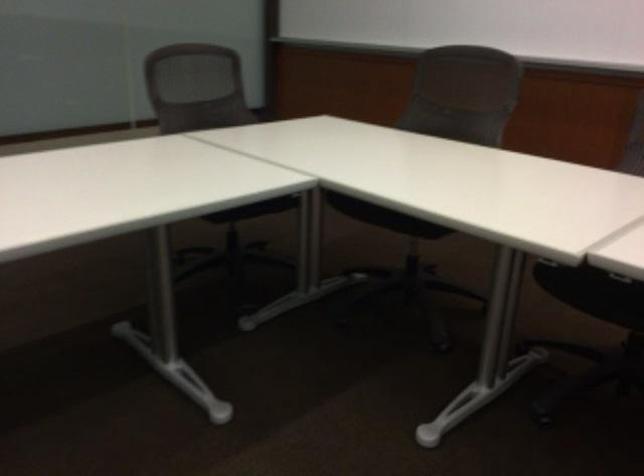
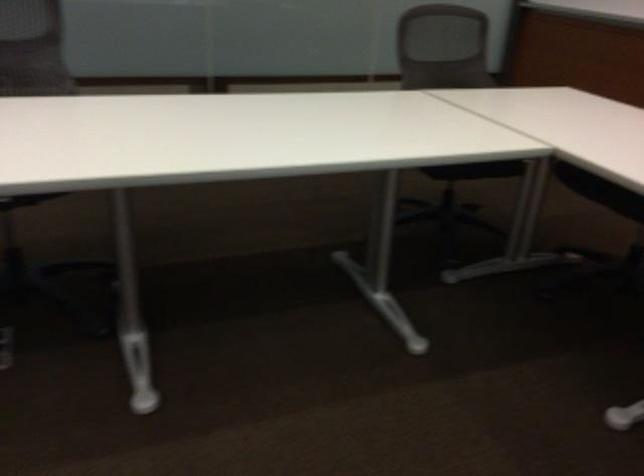
Question: In a continuous first-person perspective shot, in which direction is the camera moving?

Choices:
 (A) Left
 (B) Right
 (C) Forward
 (D) Backward

Answer: (D)